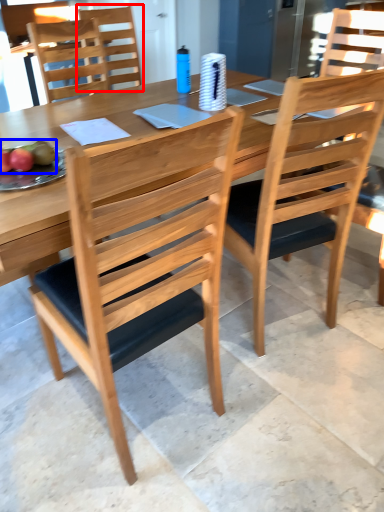
Question: Which point is further to the camera, chair (highlighted by a red box) or fruit (highlighted by a blue box)?

Choices:
 (A) chair
 (B) fruit

Answer: (A)